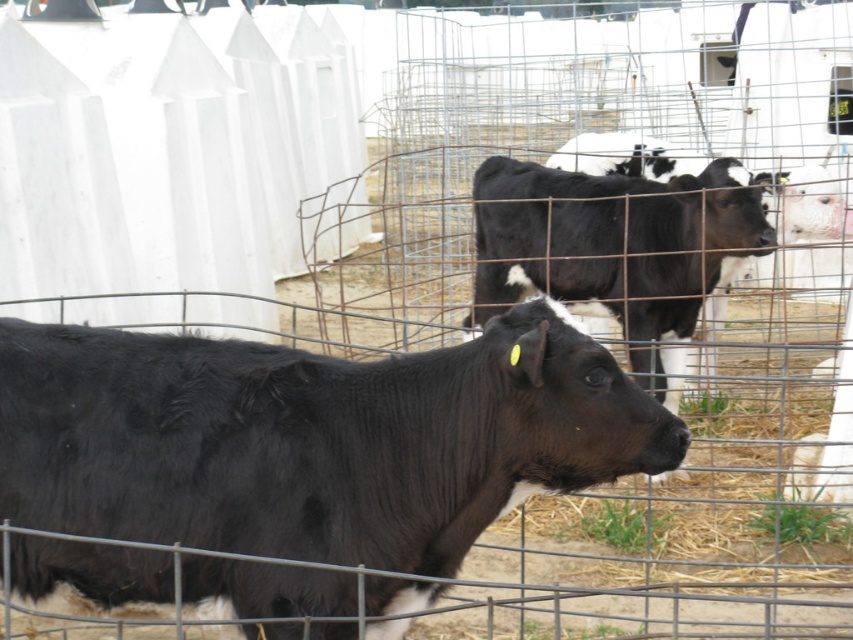
Looking at this image, can you confirm if black glossy cow at center is smaller than black smooth cow at center?

Indeed, black glossy cow at center has a smaller size compared to black smooth cow at center.

Consider the image. Can you confirm if black glossy cow at center is positioned to the right of black smooth cow at center?

No, black glossy cow at center is not to the right of black smooth cow at center.

Measure the distance between point (169, 342) and camera.

Point (169, 342) is 10.65 feet away from camera.

Identify the location of black glossy cow at center. (312, 438).